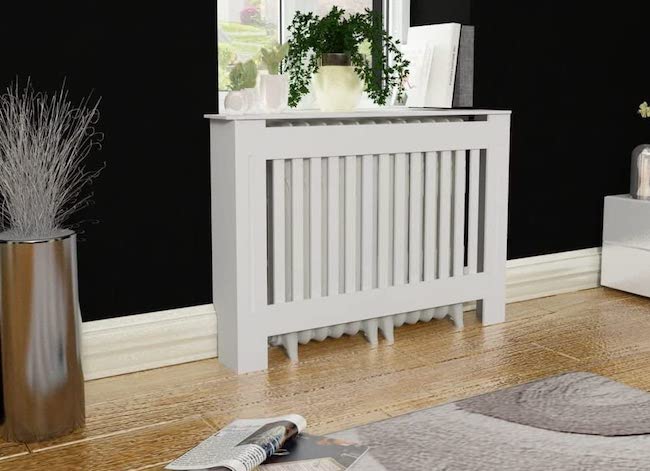
Find the location of a particular element. This screenshot has width=650, height=471. coffee table is located at coordinates (504, 438).